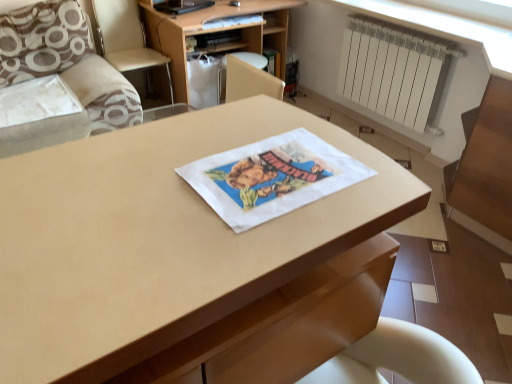
Find the location of a particular element. Image resolution: width=512 pixels, height=384 pixels. empty space that is ontop of white matte radiator at upper right is located at coordinates (406, 32).